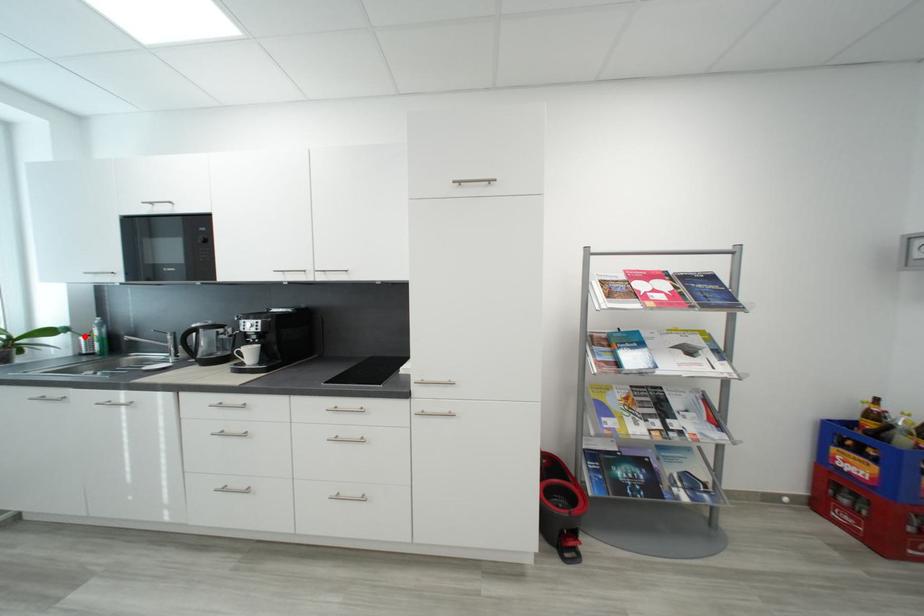
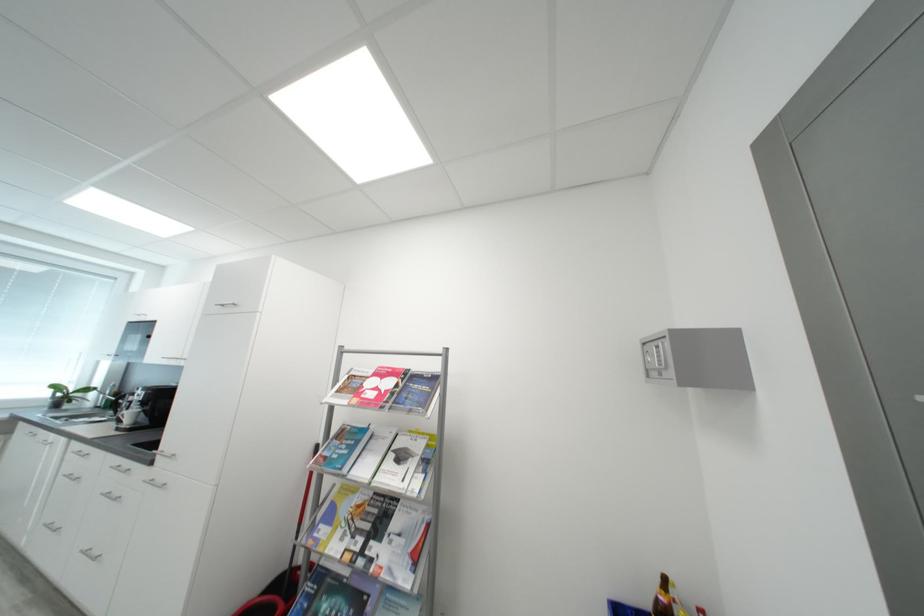
The point at the highlighted location is marked in the first image. Where is the corresponding point in the second image?

(108, 394)